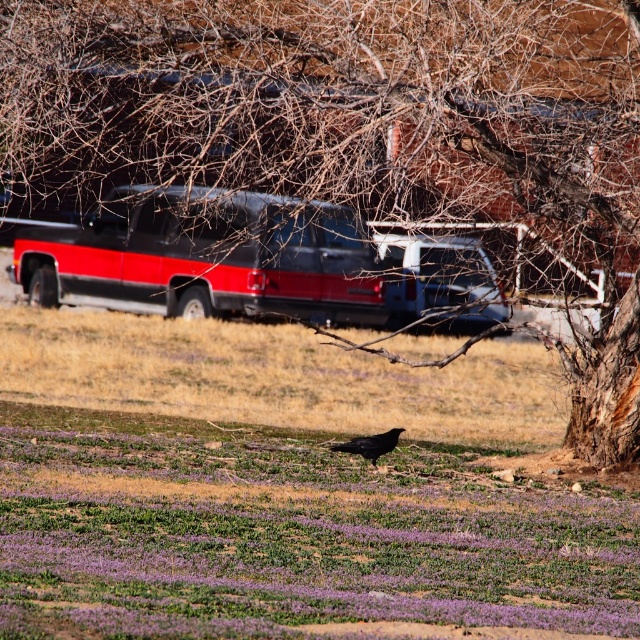
Question: Which object is positioned closest to the shiny black bird at center?

Choices:
 (A) black matte bird at center
 (B) bare wood tree at center
 (C) matte black tour bus at upper left

Answer: (B)

Question: Which object is the farthest from the black matte bird at center?

Choices:
 (A) matte black tour bus at upper left
 (B) bare wood tree at center
 (C) shiny black bird at center

Answer: (B)

Question: Does bare wood tree at center have a smaller size compared to matte black tour bus at upper left?

Choices:
 (A) no
 (B) yes

Answer: (B)

Question: Which point is closer to the camera taking this photo?

Choices:
 (A) (168, 458)
 (B) (364, 456)
 (C) (179, 205)
 (D) (628, 248)

Answer: (B)

Question: Can you confirm if black matte bird at center is wider than bare wood tree at center?

Choices:
 (A) yes
 (B) no

Answer: (A)

Question: Is black matte bird at center to the left of matte black tour bus at upper left from the viewer's perspective?

Choices:
 (A) yes
 (B) no

Answer: (B)